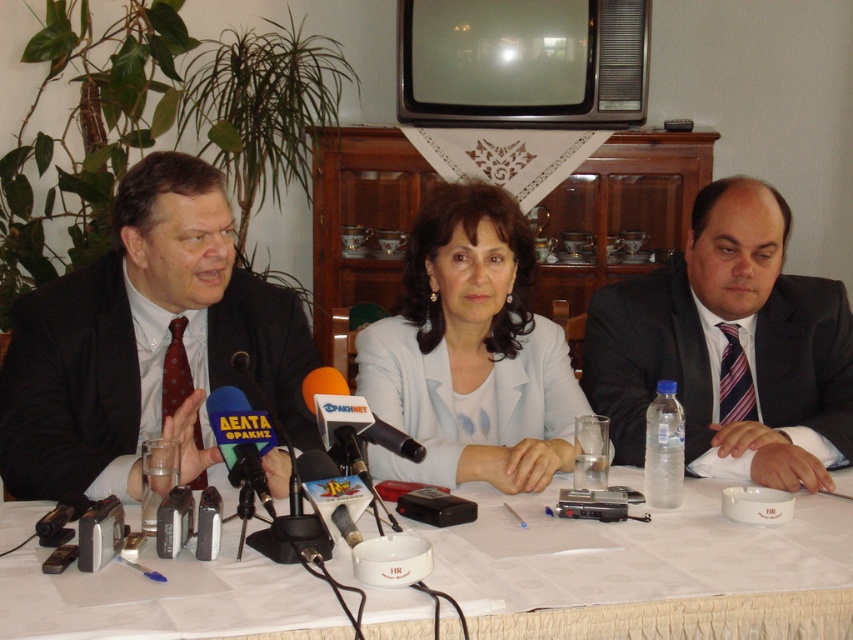
From the picture: You are a photographer standing at the back of the room. You need to take a photo of the matte black suit at left and the other person seated next to it. How far apart are they?

The matte black suit at left and the other person seated next to it are 4.61 feet apart.

You are standing 5 feet away from the table in the scene. Can you comfortably reach the matte black suit at left without moving your feet?

The matte black suit at left is 4.61 feet away from the viewer. Since you are standing 5 feet away from the table, you would need to extend your arm about 0.39 feet to reach it, which is possible if you can stretch your arm that far.

You are a photographer positioned behind the table and want to capture a clear shot of the matte black suit at left and the white matte jacket at center. Which one will appear closer to the camera in your photo?

The matte black suit at left will appear closer to the camera because it is positioned in front of the white matte jacket at center.